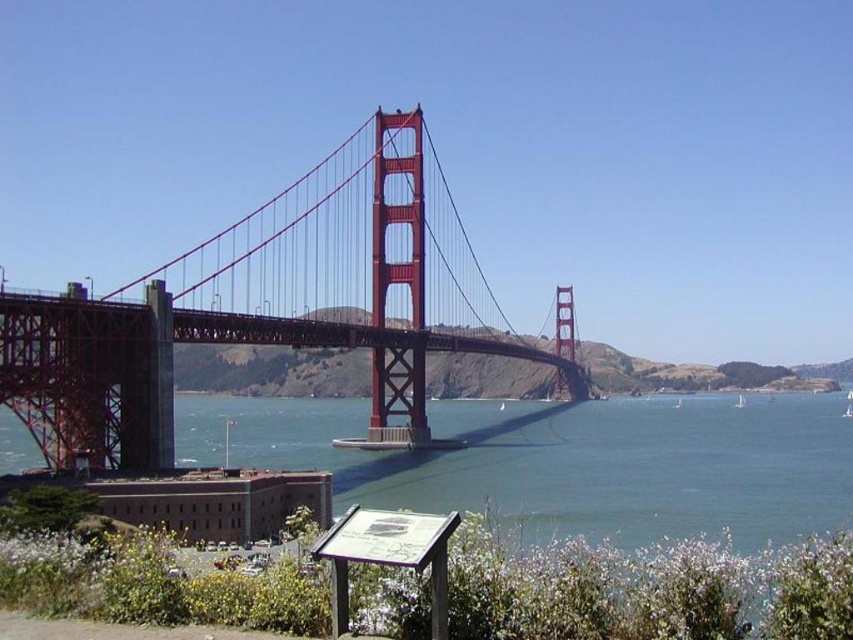
Question: Which object appears farthest from the camera in this image?

Choices:
 (A) blue water at center
 (B) painted steel bridge at center

Answer: (A)

Question: Does painted steel bridge at center appear on the left side of blue water at center?

Choices:
 (A) yes
 (B) no

Answer: (A)

Question: Is painted steel bridge at center further to camera compared to blue water at center?

Choices:
 (A) yes
 (B) no

Answer: (B)

Question: Is painted steel bridge at center to the left of blue water at center from the viewer's perspective?

Choices:
 (A) no
 (B) yes

Answer: (B)